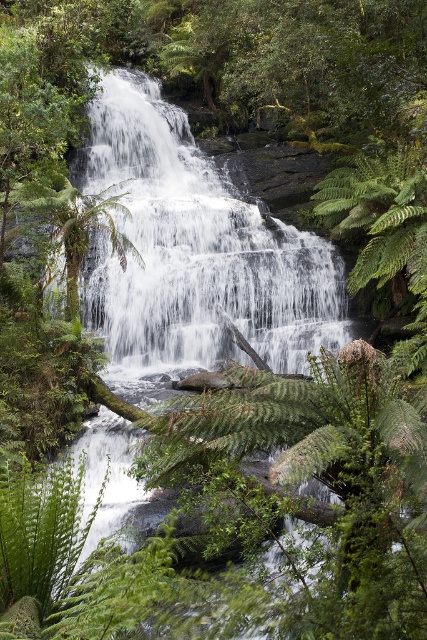
Question: Is white frothy water at center smaller than green leafy fern at lower left?

Choices:
 (A) yes
 (B) no

Answer: (B)

Question: Can you confirm if white frothy water at center is smaller than green leafy fern at lower left?

Choices:
 (A) no
 (B) yes

Answer: (A)

Question: Can you confirm if white frothy water at center is positioned to the left of green leafy fern at lower left?

Choices:
 (A) no
 (B) yes

Answer: (B)